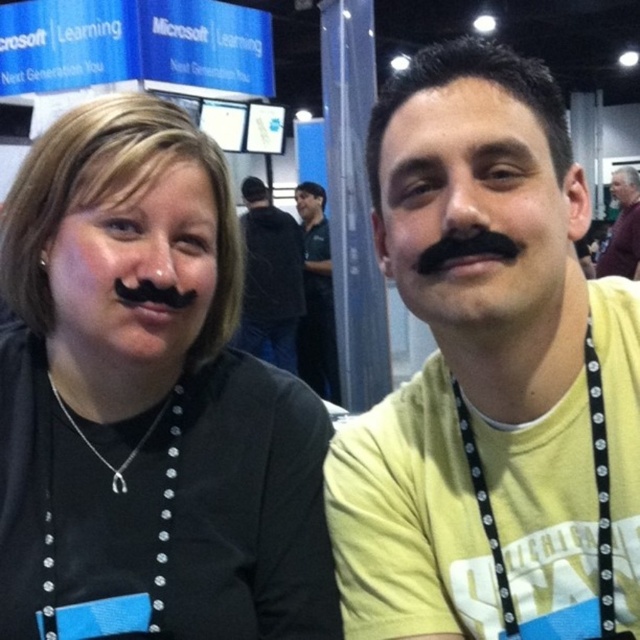
Who is positioned more to the left, dark green shirt at center or purple shirt at upper right?

Positioned to the left is dark green shirt at center.

Does dark green shirt at center appear under purple shirt at upper right?

Yes, dark green shirt at center is below purple shirt at upper right.

Who is more forward, (320, 211) or (630, 276)?

Point (630, 276) is more forward.

The height and width of the screenshot is (640, 640). I want to click on dark green shirt at center, so click(x=316, y=296).

Consider the image. Who is taller, black fabric at left or dark green shirt at center?

dark green shirt at center is taller.

Can you confirm if black fabric at left is positioned to the right of dark green shirt at center?

No, black fabric at left is not to the right of dark green shirt at center.

Image resolution: width=640 pixels, height=640 pixels. I want to click on black fabric at left, so click(x=147, y=403).

Identify the location of black fabric at left. (147, 403).

From the picture: Measure the distance between point (396, 588) and camera.

Point (396, 588) and camera are 27.65 inches apart.

Is yellow cotton shirt at center thinner than dark green shirt at center?

Incorrect, yellow cotton shirt at center's width is not less than dark green shirt at center's.

Between point (406, 474) and point (301, 243), which one is positioned behind?

The point (301, 243) is behind.

The height and width of the screenshot is (640, 640). I want to click on yellow cotton shirt at center, so click(490, 376).